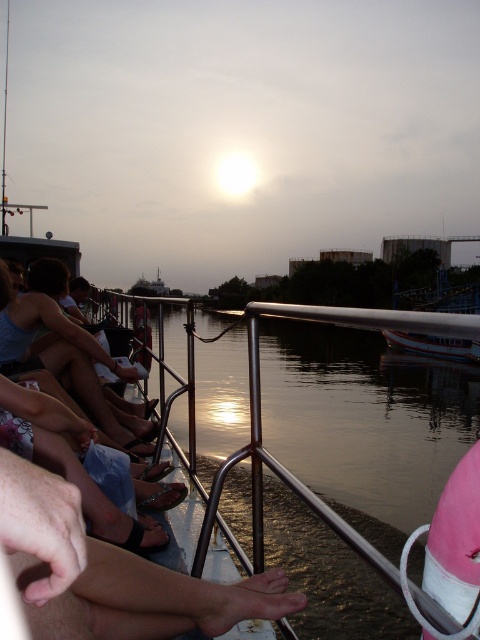
You are a photographer standing on the boat and want to capture a photo of both the smooth skin leg at lower center and the matte black shorts at left in the same frame. The camera you are using has a focal length of 50mm. Considering the distance between them, is it possible to include both subjects in the frame without moving the camera?

The distance between the smooth skin leg at lower center and the matte black shorts at left is 2.05 meters. With a 50mm focal length, the camera can comfortably capture both subjects in the same frame as the distance is within the lens field of view.

You are a photographer trying to capture the sunset. You notice two people on the boat. One has a smooth skin leg at lower center and the other has matte black shorts at left. Which object is positioned to the right side of the other?

The smooth skin leg at lower center is positioned to the right of matte black shorts at left.

You are standing on the boat and want to reach the matte black shorts at left without stepping on the metallic water at lower center. Is this possible?

The metallic water at lower center is closer to the viewer than the matte black shorts at left, so the shorts are behind the water. Therefore, you can reach the matte black shorts at left without stepping on the metallic water at lower center by moving around the water.